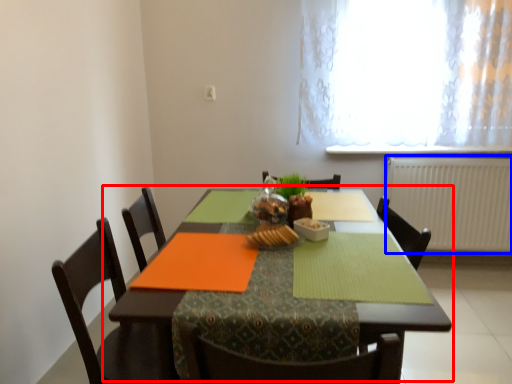
Question: Which of the following is the closest to the observer, table (highlighted by a red box) or radiator (highlighted by a blue box)?

Choices:
 (A) table
 (B) radiator

Answer: (A)